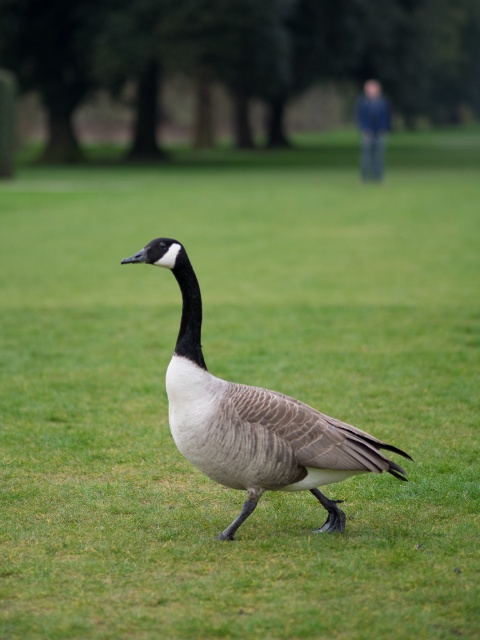
Does point (186, 397) come closer to viewer compared to point (367, 92)?

Yes, point (186, 397) is in front of point (367, 92).

Locate an element on the screen. The image size is (480, 640). gray feathered duck at center is located at coordinates (252, 419).